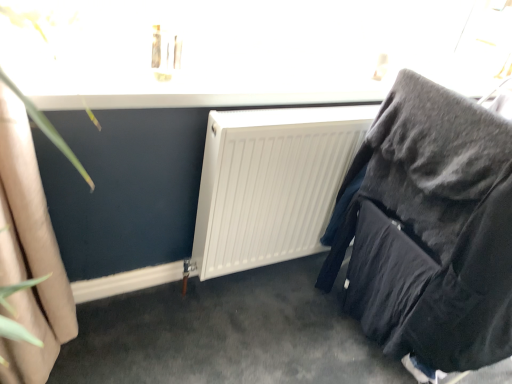
At what (x,y) coordinates should I click in order to perform the action: click on free area in between velvet black chair at right and white plastic radiator at center. Please return your answer as a coordinate pair (x, y). The image size is (512, 384). Looking at the image, I should click on (271, 328).